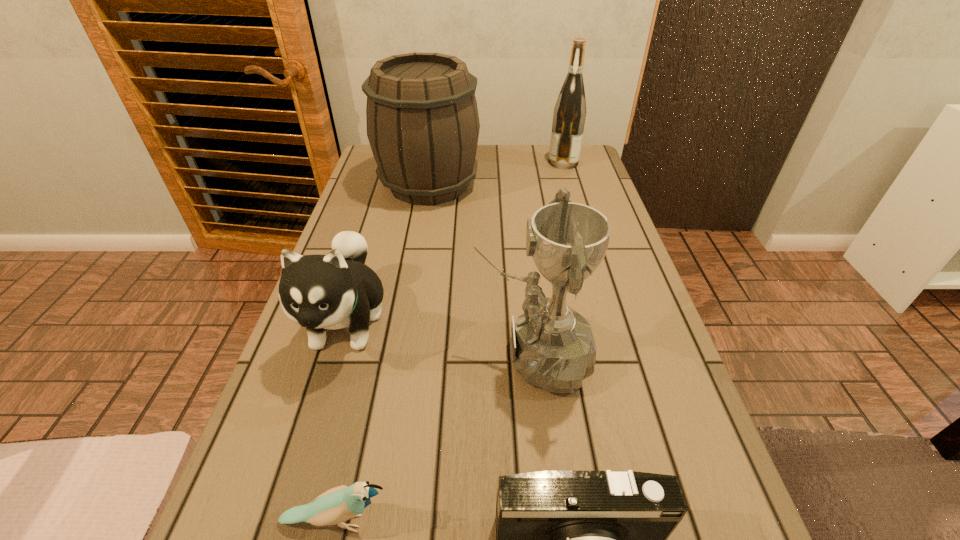
This screenshot has height=540, width=960. Identify the location of wine bottle. (569, 115).

In order to click on wine bucket in this screenshot , I will do `click(423, 125)`.

Locate an element on the screen. The width and height of the screenshot is (960, 540). award is located at coordinates (552, 345).

The width and height of the screenshot is (960, 540). What are the coordinates of `puppy` in the screenshot? It's located at [333, 291].

You are a GUI agent. You are given a task and a screenshot of the screen. Output one action in this format:
    pyautogui.click(x=<x>, y=<y>)
    Task: Click on the bird
    
    Given the screenshot: What is the action you would take?
    pyautogui.click(x=337, y=505)

At what (x,y) coordinates should I click in order to perform the action: click on blank space located 0.120m on the left of the wine bottle. Please return your answer as a coordinate pair (x, y). The width and height of the screenshot is (960, 540). Looking at the image, I should click on (513, 163).

Identify the location of vacant space located on the right of the wine bucket. Image resolution: width=960 pixels, height=540 pixels. (518, 184).

Find the location of a particular element. The width and height of the screenshot is (960, 540). free region located 0.300m on the side with emblem of the award is located at coordinates (325, 354).

At what (x,y) coordinates should I click in order to perform the action: click on vacant area located on the side with emblem of the award. Please return your answer as a coordinate pair (x, y). The image size is (960, 540). Looking at the image, I should click on (340, 354).

At what (x,y) coordinates should I click in order to perform the action: click on free region located 0.070m on the side with emblem of the award. Please return your answer as a coordinate pair (x, y). This screenshot has height=540, width=960. Looking at the image, I should click on (440, 354).